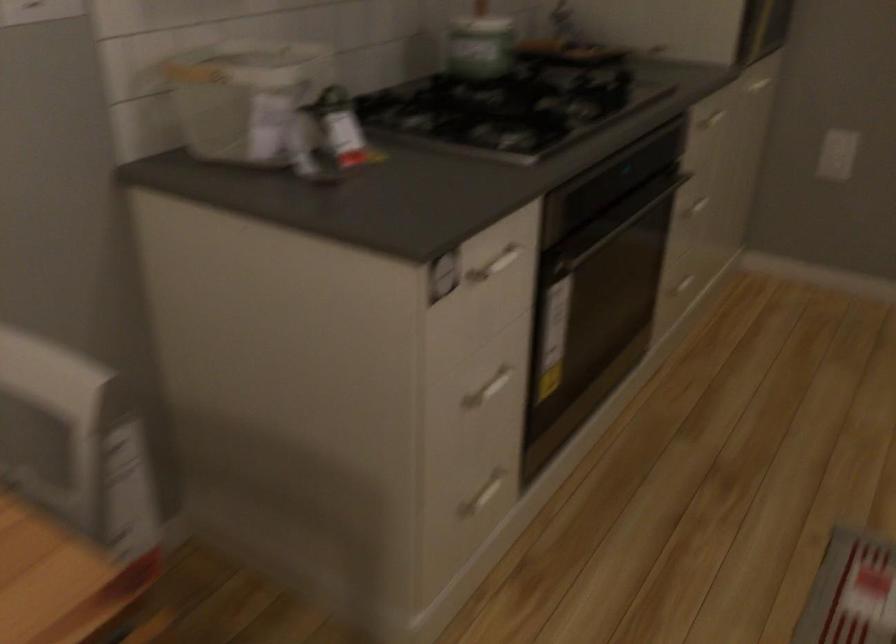
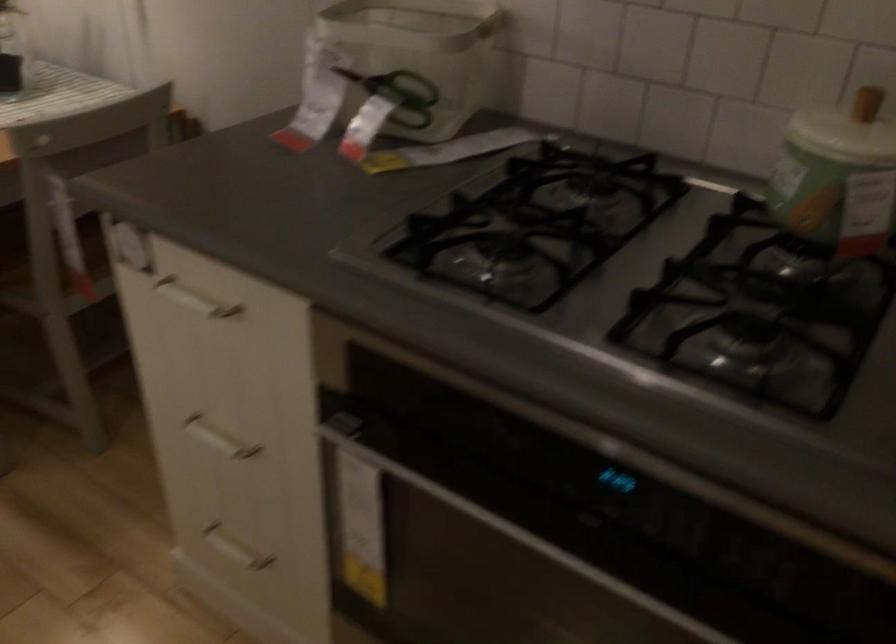
Locate, in the second image, the point that corresponds to pixel 305 118 in the first image.

(399, 93)